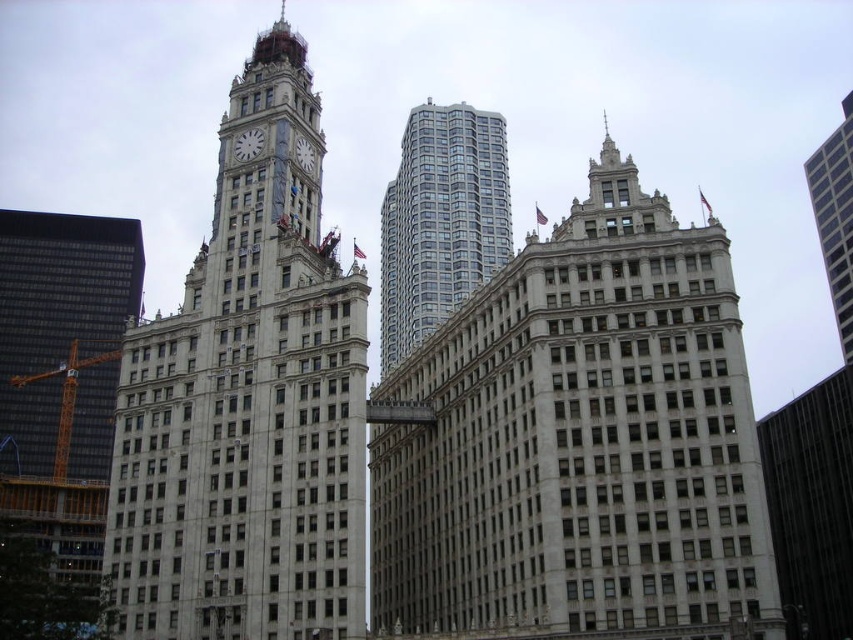
You are an architect analyzing the cityscape. You need to determine which structure is taller between the gray glass skyscraper at upper right and the white marble clock at upper center. Based on the image, which one is taller?

The gray glass skyscraper at upper right is taller than the white marble clock at upper center according to the description.